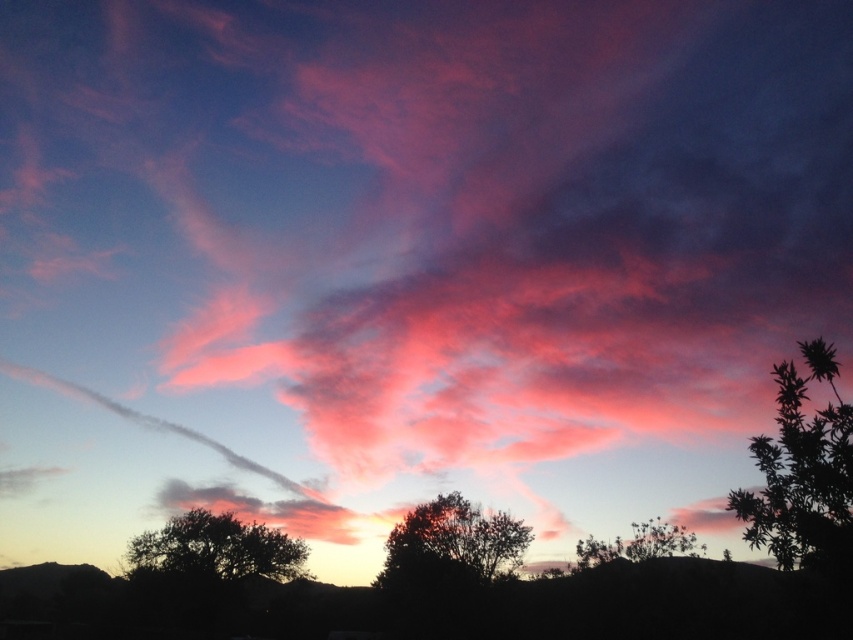
Question: Estimate the real-world distances between objects in this image. Which object is closer to the silhouette tree at lower left?

Choices:
 (A) silvery metallic tree at lower right
 (B) silvery metallic tree at right
 (C) silhouette tree at center

Answer: (C)

Question: Which point appears farthest from the camera in this image?

Choices:
 (A) (637, 547)
 (B) (778, 445)

Answer: (A)

Question: Which point is farther from the camera taking this photo?

Choices:
 (A) (247, 532)
 (B) (459, 532)
 (C) (618, 545)
 (D) (796, 540)

Answer: (A)

Question: Does silhouette tree at lower left have a lesser width compared to silvery metallic tree at lower right?

Choices:
 (A) yes
 (B) no

Answer: (B)

Question: Can you confirm if silvery metallic tree at right is bigger than silvery metallic tree at lower right?

Choices:
 (A) yes
 (B) no

Answer: (A)

Question: Is silvery metallic tree at right below silhouette tree at lower left?

Choices:
 (A) yes
 (B) no

Answer: (B)